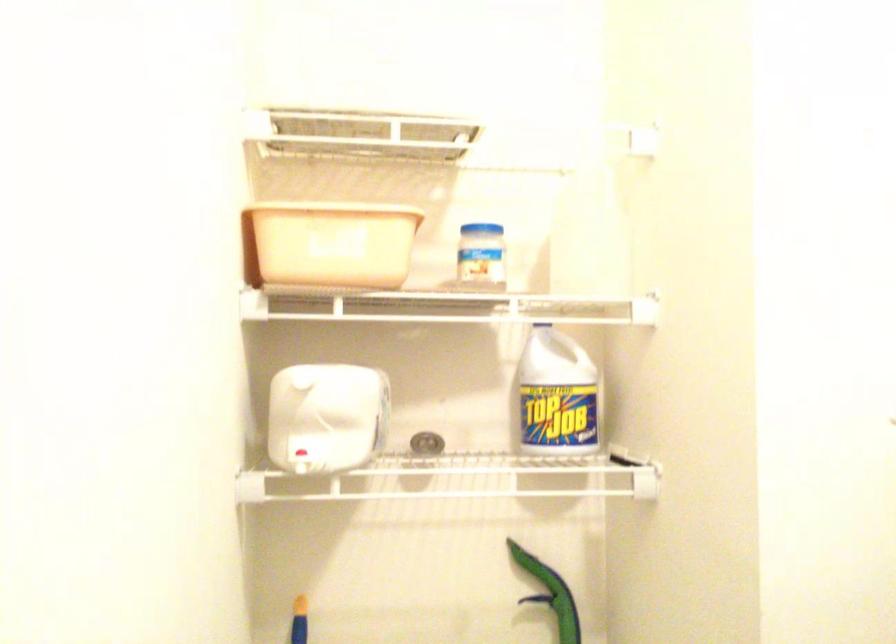
This screenshot has height=644, width=896. What do you see at coordinates (333, 243) in the screenshot?
I see `a orange plastic bin` at bounding box center [333, 243].